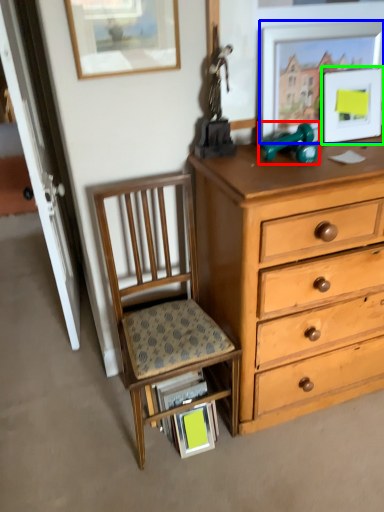
Question: Which object is the farthest from toy (highlighted by a red box)? Choose among these: picture frame (highlighted by a blue box) or picture frame (highlighted by a green box).

Choices:
 (A) picture frame
 (B) picture frame

Answer: (B)